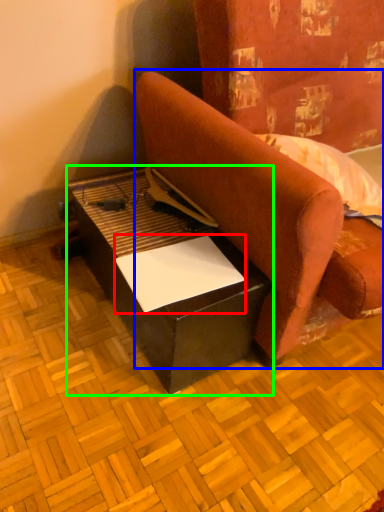
Question: Which object is the farthest from paper (highlighted by a red box)? Choose among these: studio couch (highlighted by a blue box) or table (highlighted by a green box).

Choices:
 (A) studio couch
 (B) table

Answer: (A)